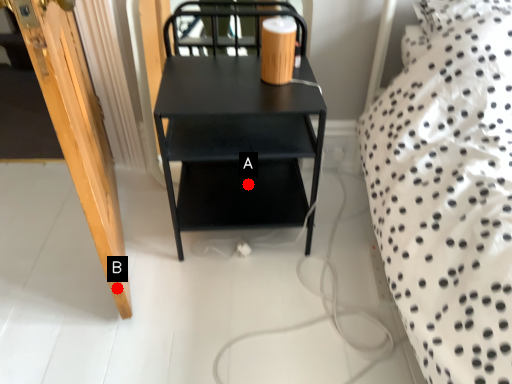
Question: Two points are circled on the image, labeled by A and B beside each circle. Among these points, which one is nearest to the camera?

Choices:
 (A) A is closer
 (B) B is closer

Answer: (B)